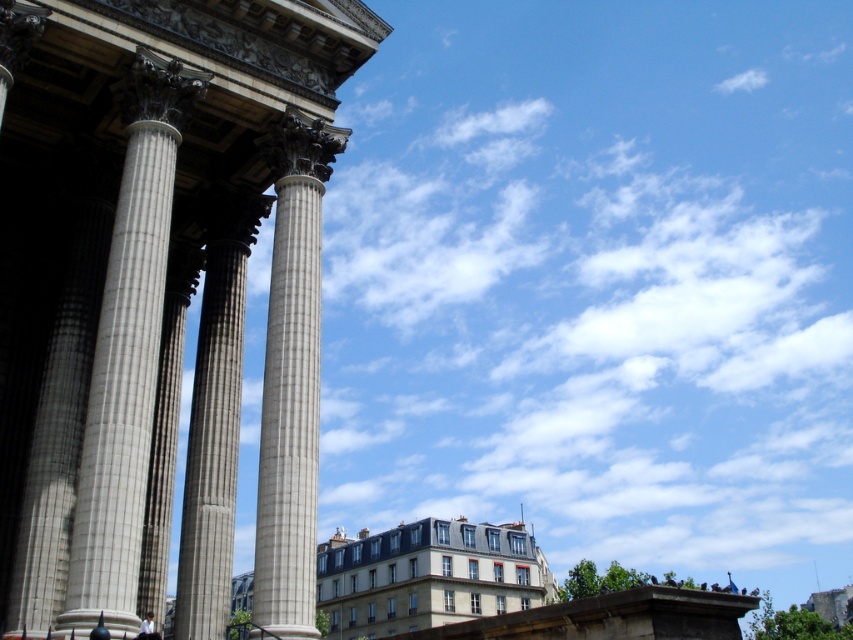
Who is lower down, white marble column at left or smooth stone column at center?

smooth stone column at center is below.

Does white marble column at left appear on the left side of smooth stone column at center?

Indeed, white marble column at left is positioned on the left side of smooth stone column at center.

In order to click on white marble column at left in this screenshot , I will do `click(126, 355)`.

At what (x,y) coordinates should I click in order to perform the action: click on white marble column at left. Please return your answer as a coordinate pair (x, y). Image resolution: width=853 pixels, height=640 pixels. Looking at the image, I should click on (126, 355).

Is white marble column at left in front of gray stone column at center?

Yes, white marble column at left is closer to the viewer.

Which is behind, point (114, 417) or point (216, 493)?

The point (216, 493) is more distant.

Who is more distant from viewer, (119, 218) or (212, 330)?

The point (212, 330) is more distant.

The height and width of the screenshot is (640, 853). I want to click on white marble column at left, so (126, 355).

Find the location of `smooth stone column at center`. smooth stone column at center is located at coordinates (291, 380).

Between smooth stone column at center and gray stone column at center, which one has more height?

smooth stone column at center is taller.

Between point (254, 566) and point (225, 272), which one is positioned in front?

Point (254, 566) is in front.

Locate an element on the screen. This screenshot has height=640, width=853. smooth stone column at center is located at coordinates (291, 380).